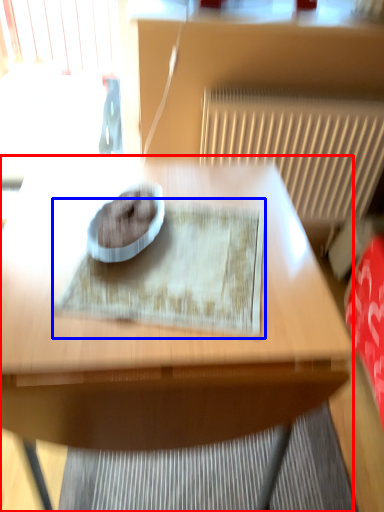
Question: Which object is further to the camera taking this photo, table (highlighted by a red box) or mat (highlighted by a blue box)?

Choices:
 (A) table
 (B) mat

Answer: (B)